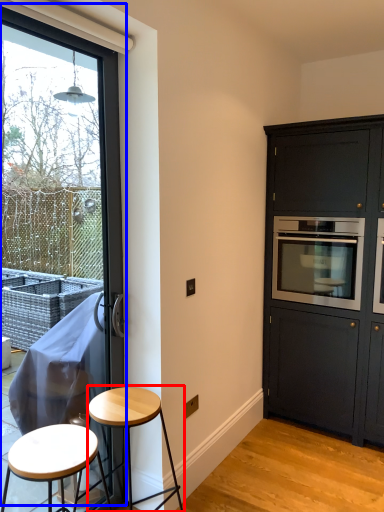
Question: Which object appears closest to the camera in this image, stool (highlighted by a red box) or window (highlighted by a blue box)?

Choices:
 (A) stool
 (B) window

Answer: (B)